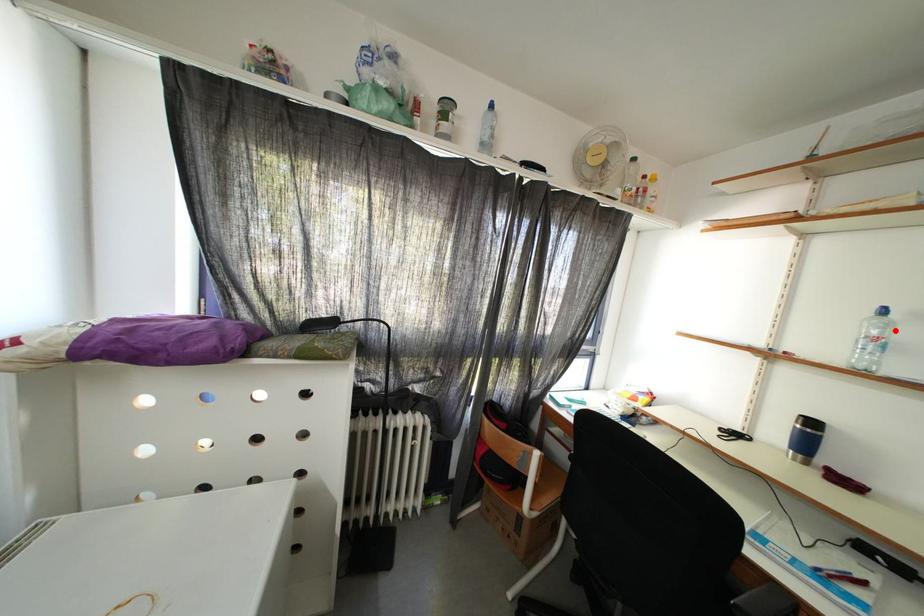
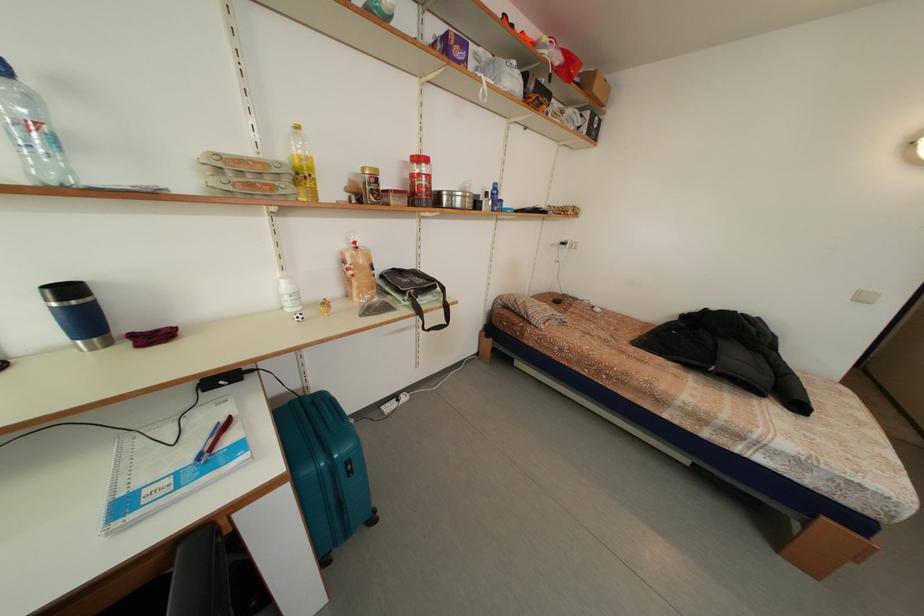
In the second image, find the point that corresponds to the highlighted location in the first image.

(40, 106)